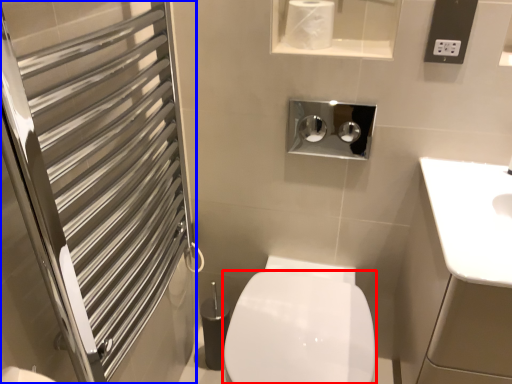
Question: Which of the following is the farthest to the observer, bidet (highlighted by a red box) or screen door (highlighted by a blue box)?

Choices:
 (A) bidet
 (B) screen door

Answer: (A)